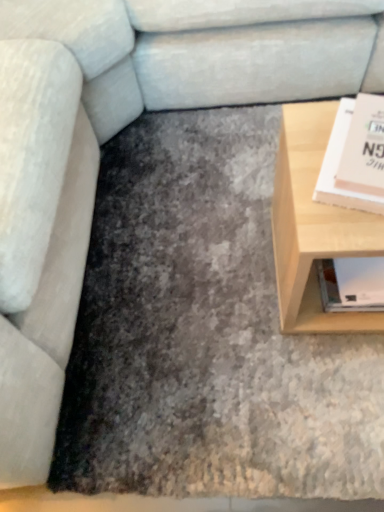
The image size is (384, 512). I want to click on vacant space situated on the left part of light wood table at right, so click(x=220, y=286).